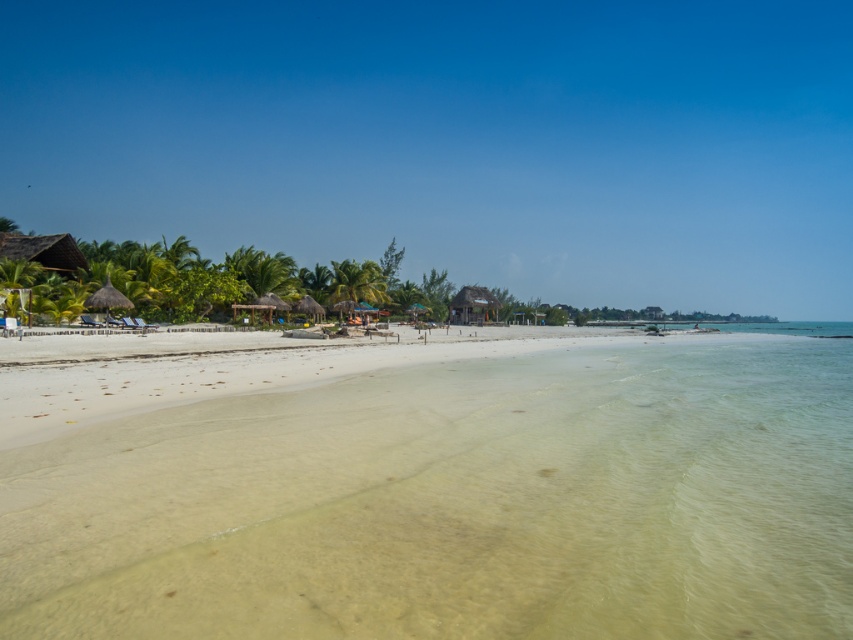
You are a lifeguard standing on the white sand beach at center and need to reach the thatched roof hut at center to retrieve a first aid kit. Considering the distance between them, can you estimate how long it would take you to walk there at a normal pace?

The distance between the white sand beach at center and the thatched roof hut at center is 55.30 meters. At a normal walking pace of approximately 1.4 meters per second, it would take roughly 39.5 seconds to reach the thatched roof hut at center.

You are standing at the origin point of the coordinate system. Which direction should you move to reach the white sand beach at center?

The white sand beach at center is located at point 0.787 on the x axis and 0.536 on the y axis. Since the coordinate system is relative to the image, moving towards the right and slightly upwards from the origin would lead you to the white sand beach at center.

You are planning to set up a small tent for a beach picnic. The tent requires a flat area of at least 3 meters in width. Given the white sand beach at center and the thatched roof hut at center, which location would be more suitable for setting up your tent?

The white sand beach at center has a larger width than the thatched roof hut at center, so it would be more suitable for setting up the tent as it provides a wider flat area.